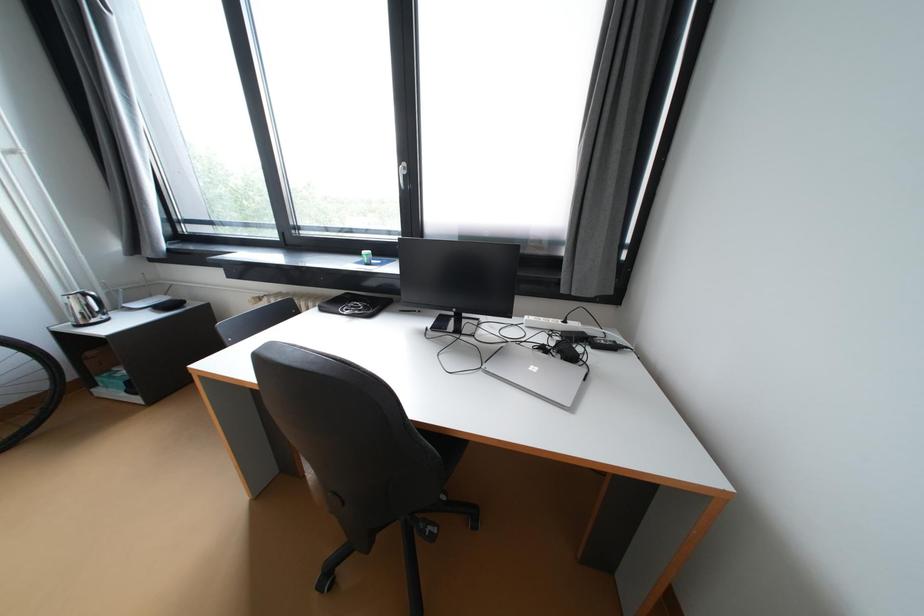
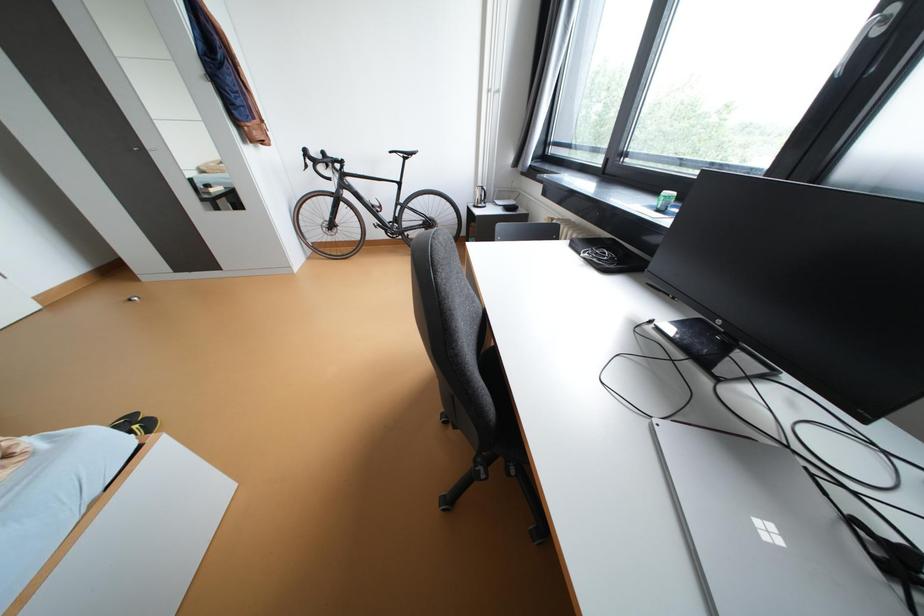
First-person continuous shooting, in which direction is the camera rotating?

The camera's rotation is toward left-down.